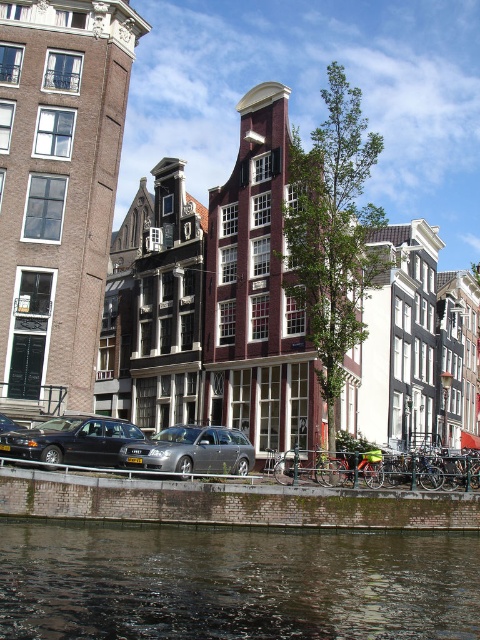
Question: Where is dark green water at lower center located in relation to shiny black sedan at lower left in the image?

Choices:
 (A) below
 (B) above

Answer: (A)

Question: Estimate the real-world distances between objects in this image. Which object is farther from the shiny black sedan at lower left?

Choices:
 (A) dark green water at lower center
 (B) metallic gray wagon at center

Answer: (A)

Question: Is dark green water at lower center bigger than shiny black sedan at lower left?

Choices:
 (A) yes
 (B) no

Answer: (A)

Question: Estimate the real-world distances between objects in this image. Which object is closer to the shiny black sedan at lower left?

Choices:
 (A) metallic gray wagon at center
 (B) dark green water at lower center

Answer: (A)

Question: From the image, what is the correct spatial relationship of shiny black sedan at lower left in relation to metallic gray wagon at center?

Choices:
 (A) below
 (B) above

Answer: (B)

Question: Which of the following is the farthest from the observer?

Choices:
 (A) (362, 600)
 (B) (233, 449)
 (C) (48, 424)

Answer: (B)